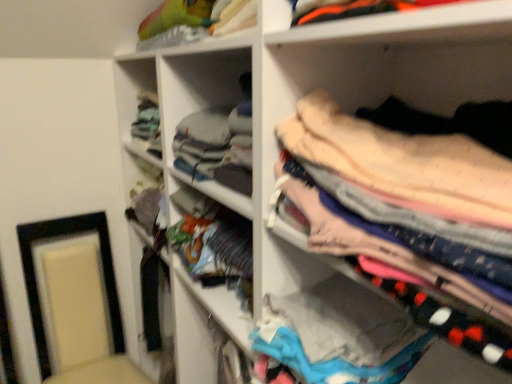
Question: Is there a large distance between soft pink fabric at upper right and matte black picture frame at lower left?

Choices:
 (A) no
 (B) yes

Answer: (B)

Question: From a real-world perspective, is soft pink fabric at upper right physically below matte black picture frame at lower left?

Choices:
 (A) no
 (B) yes

Answer: (A)

Question: Considering the relative sizes of soft pink fabric at upper right and matte black picture frame at lower left in the image provided, is soft pink fabric at upper right bigger than matte black picture frame at lower left?

Choices:
 (A) no
 (B) yes

Answer: (A)

Question: Is matte black picture frame at lower left inside soft pink fabric at upper right?

Choices:
 (A) yes
 (B) no

Answer: (B)

Question: From the image's perspective, is soft pink fabric at upper right on matte black picture frame at lower left?

Choices:
 (A) no
 (B) yes

Answer: (B)

Question: Is soft pink fabric at upper right placed right next to matte black picture frame at lower left?

Choices:
 (A) yes
 (B) no

Answer: (B)

Question: Is matte black picture frame at lower left facing away from soft pink fabric at upper right?

Choices:
 (A) no
 (B) yes

Answer: (A)

Question: Is matte black picture frame at lower left closer to the viewer compared to soft pink fabric at upper right?

Choices:
 (A) no
 (B) yes

Answer: (A)

Question: Is matte black picture frame at lower left facing towards soft pink fabric at upper right?

Choices:
 (A) no
 (B) yes

Answer: (A)

Question: From the image's perspective, is matte black picture frame at lower left below soft pink fabric at upper right?

Choices:
 (A) no
 (B) yes

Answer: (B)

Question: From a real-world perspective, does matte black picture frame at lower left stand above soft pink fabric at upper right?

Choices:
 (A) yes
 (B) no

Answer: (B)

Question: Can you confirm if matte black picture frame at lower left is thinner than soft pink fabric at upper right?

Choices:
 (A) no
 (B) yes

Answer: (A)

Question: Is point (112, 301) positioned closer to the camera than point (451, 233)?

Choices:
 (A) farther
 (B) closer

Answer: (A)